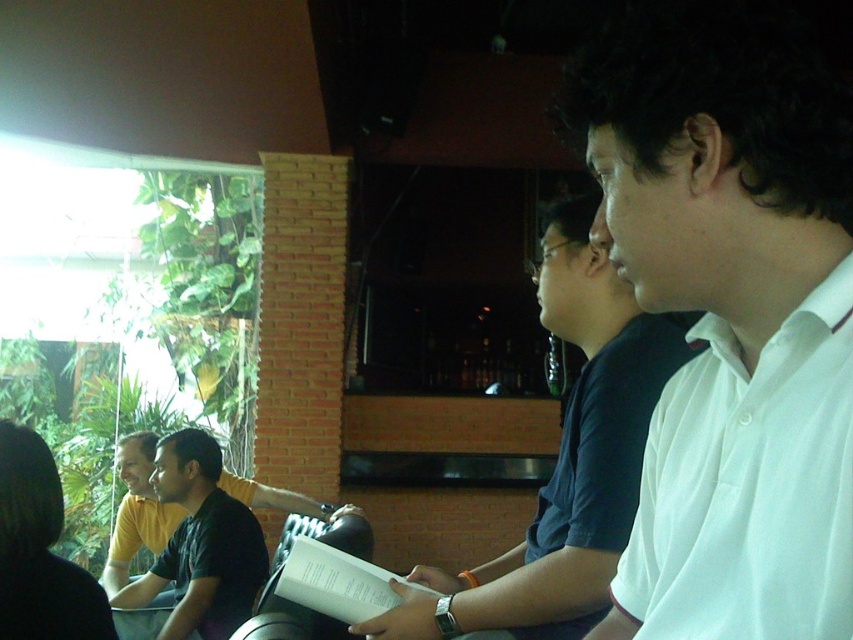
You are organizing a clothing display and need to arrange the white smooth shirt at center and the white cotton shirt at right side by side. Which shirt should you place on the left to ensure they fit within a 1.2 meter wide display rack?

The white smooth shirt at center has a smaller width than the white cotton shirt at right, so place the white smooth shirt at center on the left and the white cotton shirt at right on the right to utilize the space efficiently.

You are organizing a photo shoot and need to ensure that all participants are visible in the frame. Given the current arrangement, which participant is taking up more space in the image between the white smooth shirt at center and the dark green shirt at center?

The dark green shirt at center occupies more space in the image than the white smooth shirt at center, so it is more visible.

You are a photographer trying to capture a group photo of the white cotton shirt at right and the dark green shirt at center. The camera you are using has a minimum focus distance of 5 feet. Will you be able to take a clear photo of both subjects without moving them?

The white cotton shirt at right and dark green shirt at center are 4.87 feet apart, so the distance between them is less than the camera minimum focus distance of 5 feet. Therefore, you can take a clear photo of both subjects without moving them.